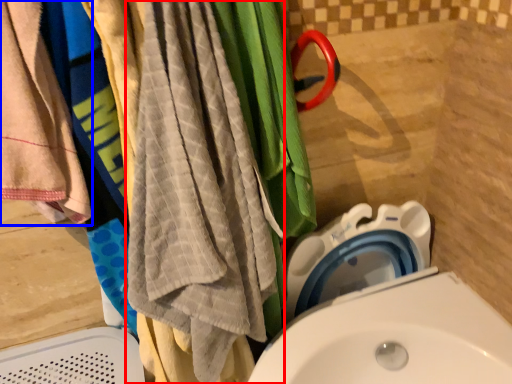
Question: Among these objects, which one is farthest to the camera, beach towel (highlighted by a red box) or towel (highlighted by a blue box)?

Choices:
 (A) beach towel
 (B) towel

Answer: (B)